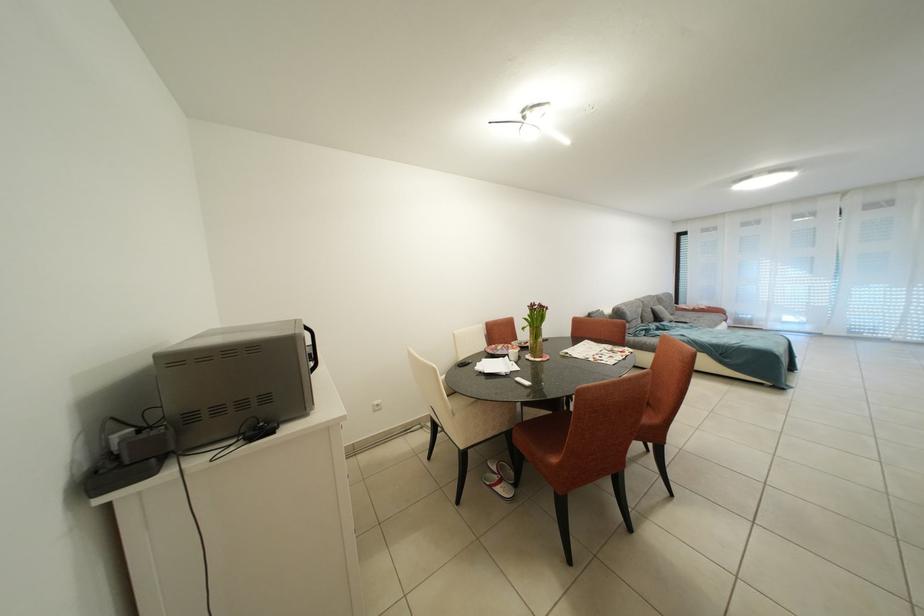
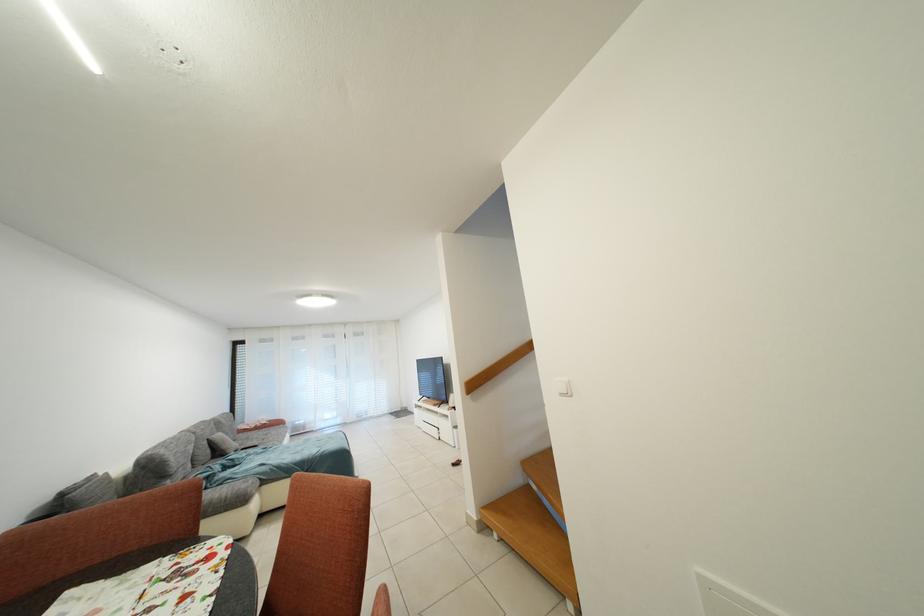
In the second image, find the point that corresponds to pixel 667 313 in the first image.

(227, 440)